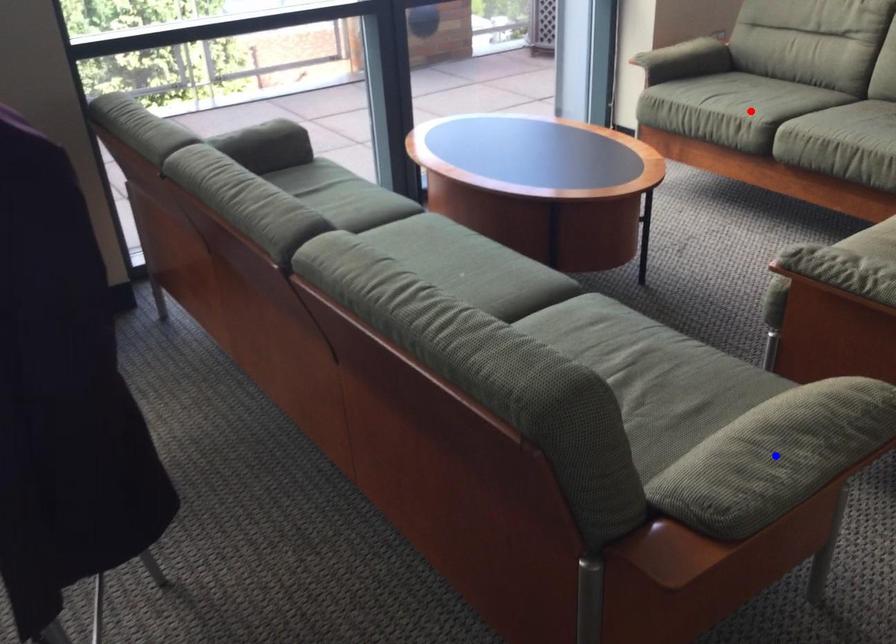
Question: In the image, two points are highlighted. Which point is nearer to the camera? Reply with the corresponding letter.

Choices:
 (A) blue point
 (B) red point

Answer: (A)